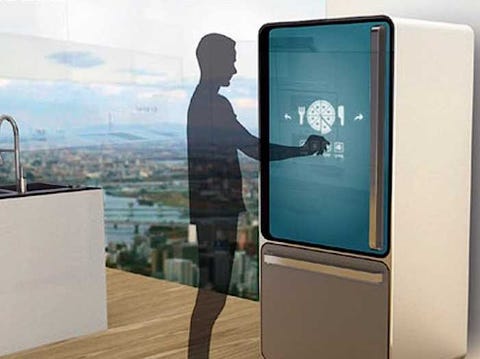
You are a GUI agent. You are given a task and a screenshot of the screen. Output one action in this format:
    pyautogui.click(x=<x>, y=<y>)
    Task: Click on the refrigerator
    This screenshot has height=359, width=480.
    Given the screenshot: What is the action you would take?
    pyautogui.click(x=429, y=142)